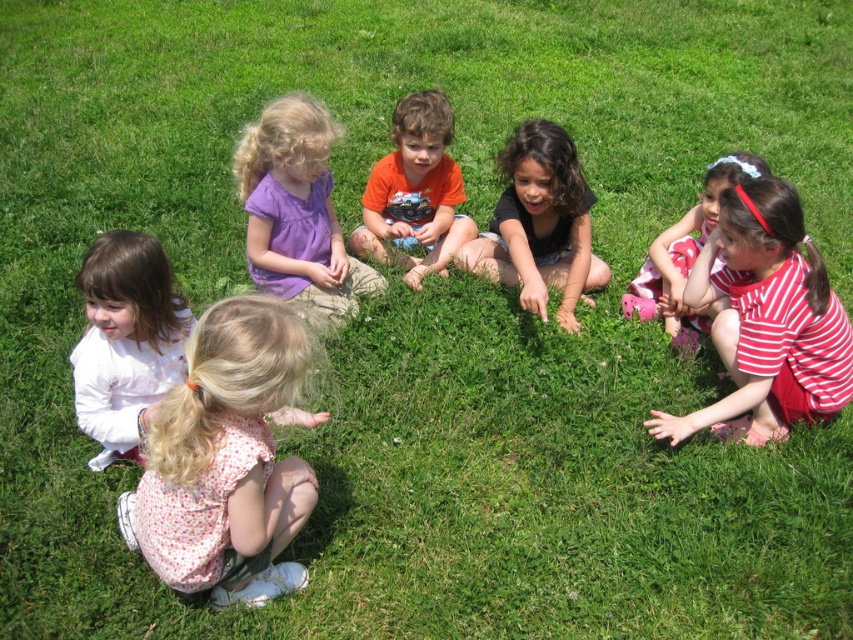
Question: Which object appears closest to the camera in this image?

Choices:
 (A) orange cotton shirt at center
 (B) striped cotton dress at lower right
 (C) dark brown hair at center

Answer: (B)

Question: Is striped cotton dress at lower right behind dark brown hair at center?

Choices:
 (A) no
 (B) yes

Answer: (A)

Question: Does white matte shirt at lower left have a larger size compared to dark brown hair at center?

Choices:
 (A) yes
 (B) no

Answer: (B)

Question: Which point appears farthest from the camera in this image?

Choices:
 (A) (665, 301)
 (B) (392, 120)

Answer: (B)

Question: Which of the following is the farthest from the observer?

Choices:
 (A) (376, 182)
 (B) (181, 298)

Answer: (A)

Question: Does striped cotton dress at lower right appear on the right side of striped fabric dress at upper right?

Choices:
 (A) yes
 (B) no

Answer: (B)